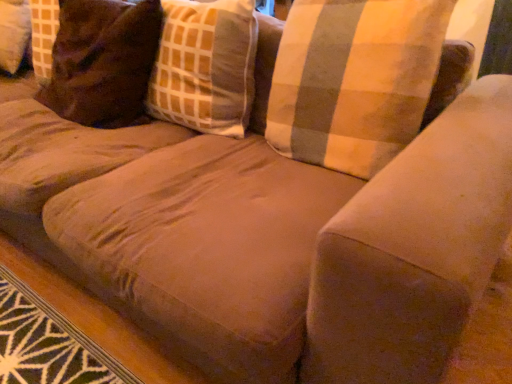
Question: From the image's perspective, is brown suede pillow at upper left, positioned as the first pillow in left-to-right order, above or below plaid fabric pillow at upper right, the 1th pillow positioned from the right?

Choices:
 (A) above
 (B) below

Answer: (A)

Question: From a real-world perspective, is brown suede pillow at upper left, positioned as the first pillow in left-to-right order, positioned above or below plaid fabric pillow at upper right, the 1th pillow positioned from the right?

Choices:
 (A) below
 (B) above

Answer: (A)

Question: Estimate the real-world distances between objects in this image. Which object is closer to the plaid fabric pillow at upper right, placed as the second pillow when sorted from left to right?

Choices:
 (A) brown suede pillow at upper left, positioned as the first pillow in left-to-right order
 (B) plaid fabric pillow at center

Answer: (B)

Question: Which of these objects is positioned farthest from the brown suede pillow at upper left, positioned as the first pillow in left-to-right order?

Choices:
 (A) plaid fabric pillow at center
 (B) plaid fabric pillow at upper right, the 1th pillow positioned from the right

Answer: (B)